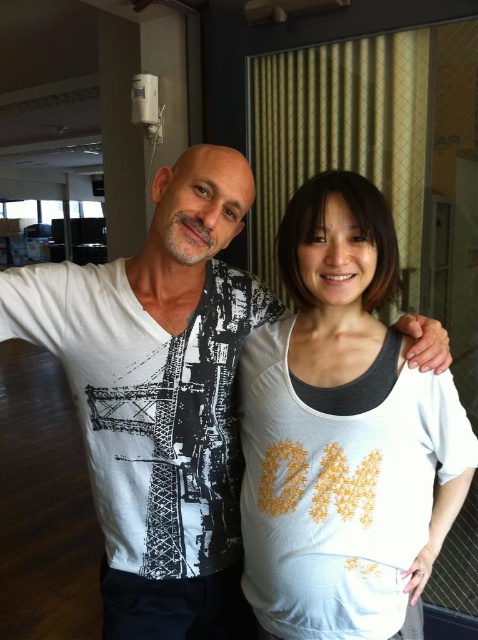
You are a photographer setting up for a photoshoot and need to position a light source to the left of both the white cotton tank top at center and the white printed shirt at center. Is this possible given their current positions?

The white cotton tank top at center is to the right of the white printed shirt at center, so placing a light source to the left of both is possible as they are positioned side by side with space to their left.

You are a photographer setting up for a photoshoot. You have two white tops in the scene, a white cotton tank top at center and a white printed shirt at center. The camera you are using has a lens with a focal length of 50mm. To ensure both tops are in focus, what is the minimum distance you should keep between the camera and the subjects?

The white cotton tank top at center is 8.93 inches from the white printed shirt at center. To ensure both tops are in focus with a 50mm lens, the minimum distance should be calculated using the hyperfocal distance formula. However, without specific aperture and acceptable circle of confusion values, a general rule is to focus approximately one third into the scene. Since the distance between the two tops is 8.93 inches, positioning the camera at least 13.4 inches away would help keep both in focus.

You are helping a customer at a clothing store who wants to buy a white top to wear over another white top. The customer is looking at the white cotton tank top at center and the white printed shirt at center. Which one should they wear on top?

The customer should wear the white printed shirt at center on top because the white cotton tank top at center is positioned under it.